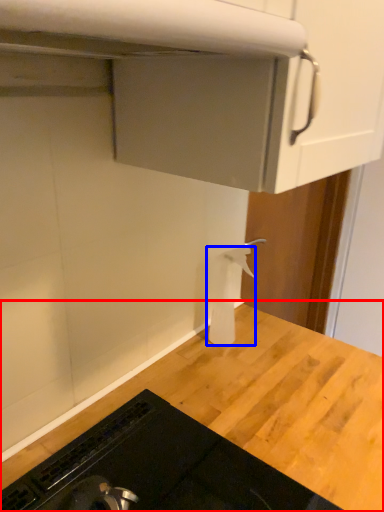
Question: Which point is further to the camera, countertop (highlighted by a red box) or toilet paper (highlighted by a blue box)?

Choices:
 (A) countertop
 (B) toilet paper

Answer: (B)